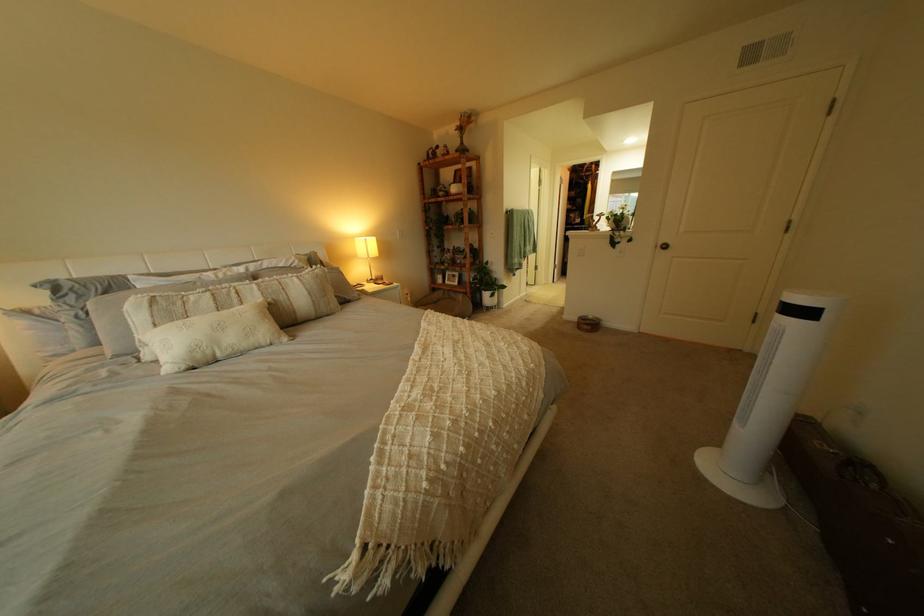
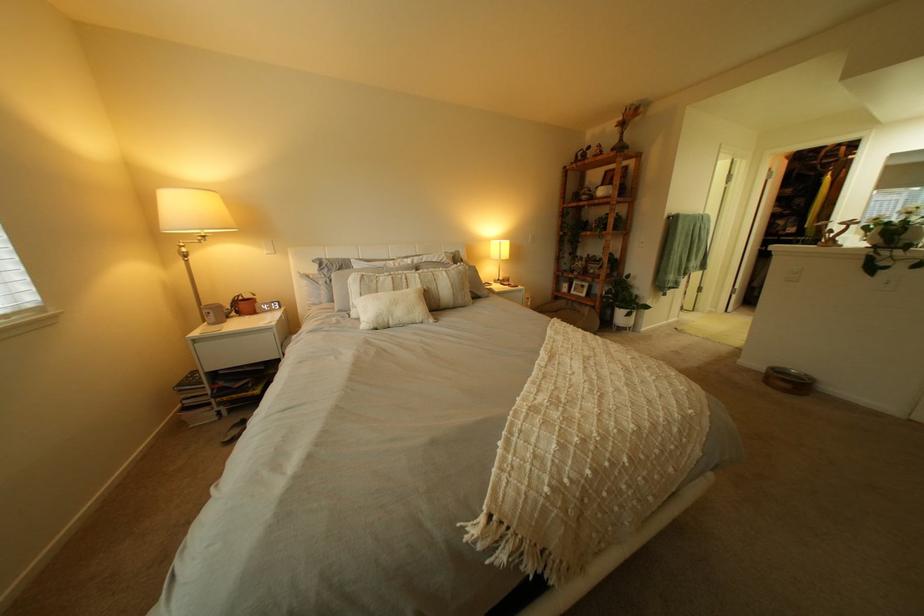
In the second image, find the point that corresponds to pixel 499 288 in the first image.

(633, 305)